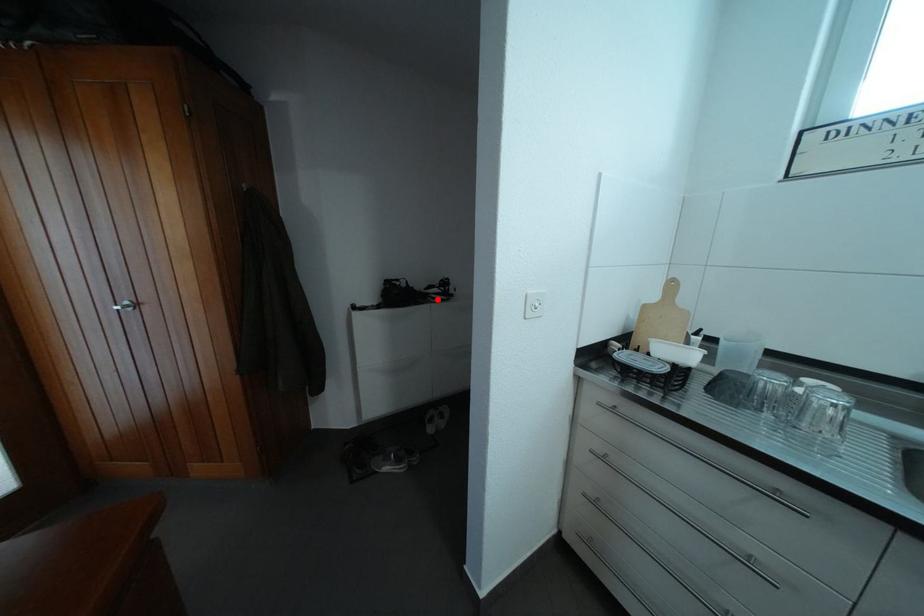
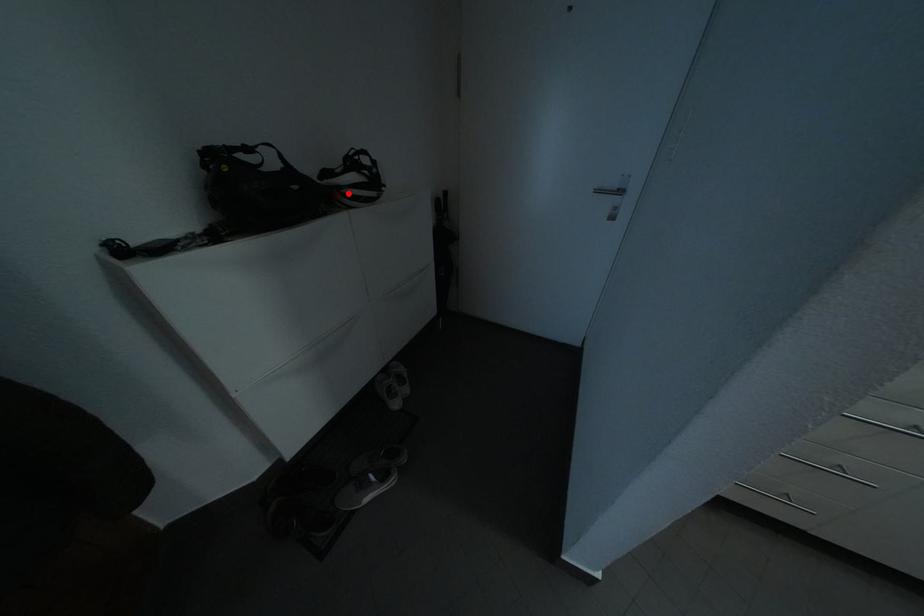
I am providing you with two images of the same scene from different viewpoints. A red point is marked on the first image and another point is marked on the second image. Are the points marked in image1 and image2 representing the same 3D position?

Yes